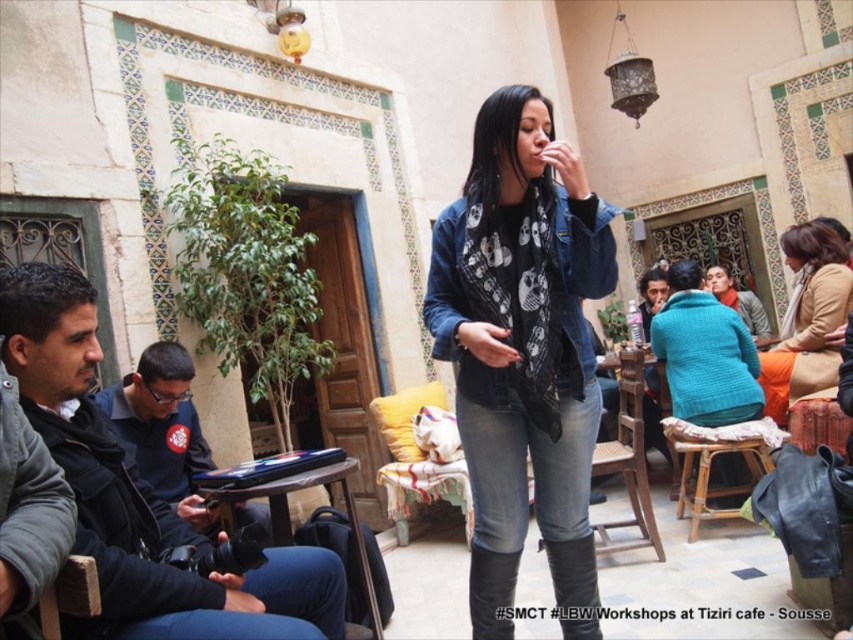
You are a photographer standing at the camera position. You want to take a closeup photo of the beige woolen scarf at upper right. Can you reach it with your 1.5 meter long extendable pole?

The beige woolen scarf at upper right is 4.67 meters away from camera. The extendable pole is only 1.5 meters long, so it is not long enough to reach the scarf.

You are standing in the traditional North African style cafe with intricate blue and green tilework. You notice two points marked in the scene. The first point is at coordinates point (517, 531) and the second is at point (706, 497). Which point is closer to you?

Point (517, 531) is in front of point (706, 497), so it is closer to you.